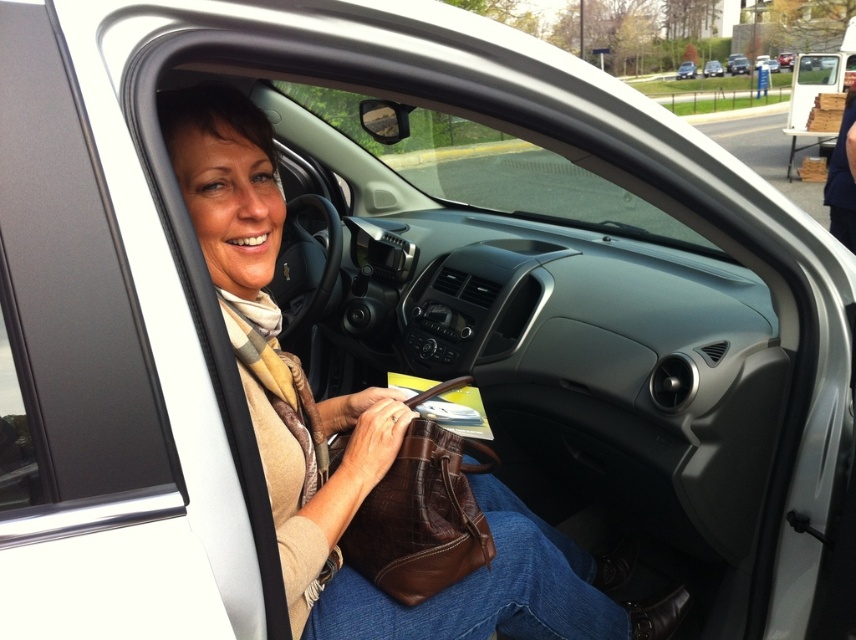
You are a parking attendant who needs to guide a driver to park their car. The driver wants to park their new car between the silver metallic sedan at upper center and the white matte car at center. Based on the scene description, is this possible?

The silver metallic sedan at upper center is positioned on the right side of the white matte car at center, so there is space between them for the driver to park their new car between the silver metallic sedan at upper center and the white matte car at center.

The woman is holding two items in her lap, a brown leather purse at center and a brown leather handbag at center. Which one is wider?

The brown leather purse at center is wider than the brown leather handbag at center.

You are a delivery person who needs to place a small package inside the car. The driver is seated in the driver seat with the door open. Where should you place the package so it is between the brown leather purse at center and the white matte car at center?

Place the package to the right of the brown leather purse at center, as it is to the left of the white matte car at center, so the package will be between them.